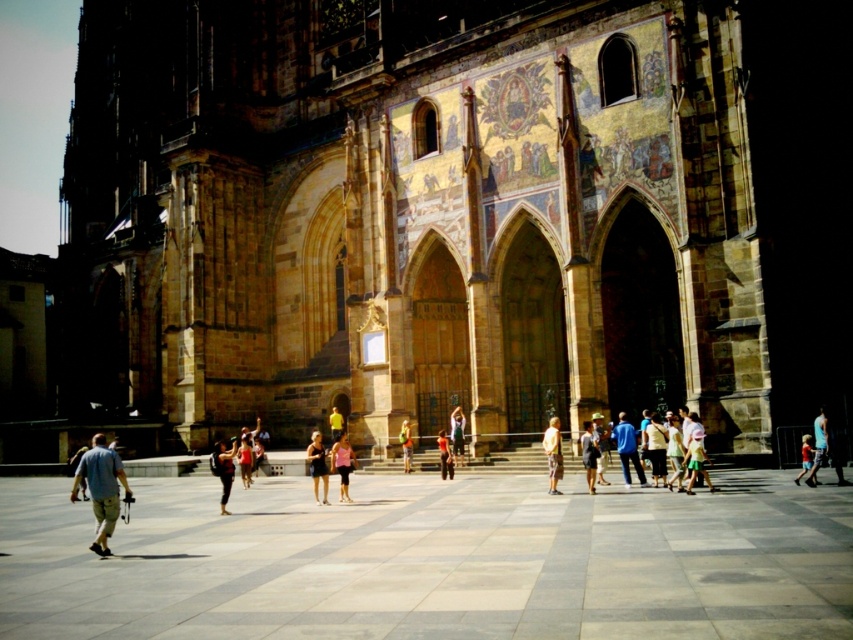
Question: Is dark blue jeans at center bigger than matte black shorts at center?

Choices:
 (A) no
 (B) yes

Answer: (B)

Question: Is dark blue jeans at center positioned at the back of light pink fabric dress at center?

Choices:
 (A) yes
 (B) no

Answer: (B)

Question: Which point is farther from the camera taking this photo?

Choices:
 (A) (444, 480)
 (B) (596, 468)

Answer: (A)

Question: Which of these objects is positioned farthest from the matte black shorts at center?

Choices:
 (A) blue fabric shirt at center
 (B) light brown leather jacket at center
 (C) yellow shirt at center
 (D) orange fabric pants at center

Answer: (A)

Question: Which object appears closest to the camera in this image?

Choices:
 (A) blue denim shorts at lower right
 (B) yellow shirt at center
 (C) light brown wooden stick at center

Answer: (A)

Question: Observing the image, what is the correct spatial positioning of matte black shorts at center in reference to light pink fabric dress at center?

Choices:
 (A) above
 (B) below

Answer: (B)